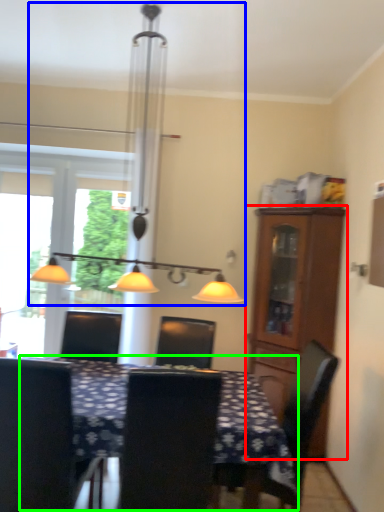
Question: Considering the real-world distances, which object is farthest from cabinetry (highlighted by a red box)? table lamp (highlighted by a blue box) or table (highlighted by a green box)?

Choices:
 (A) table lamp
 (B) table

Answer: (B)